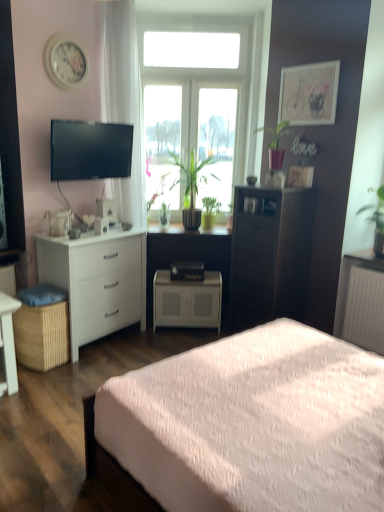
Find the location of a particular element. This screenshot has height=512, width=384. empty space that is ontop of brown woven picnic basket at lower left (from a real-world perspective) is located at coordinates (36, 292).